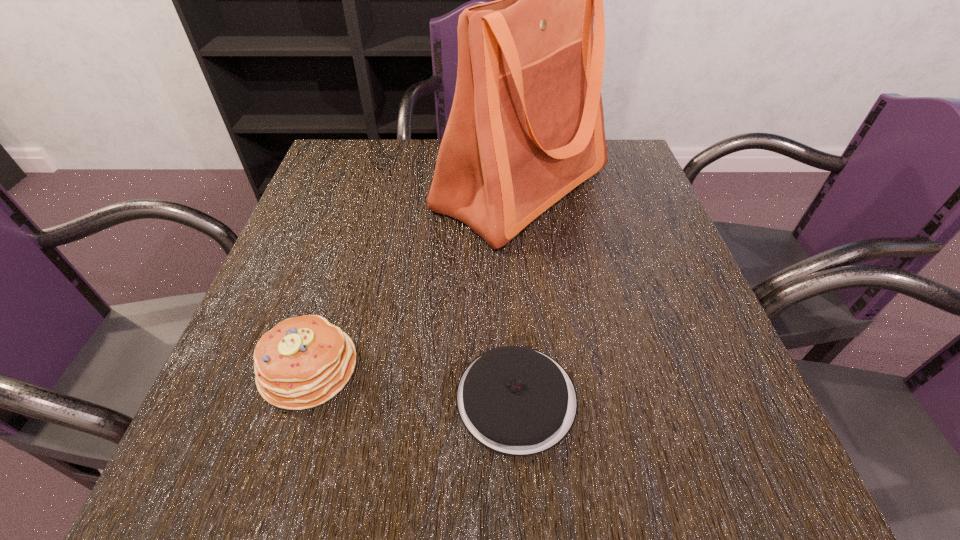
Identify the location of free area in between the farthest object and the shorter pancake. (519, 294).

The image size is (960, 540). What are the coordinates of `blank region between the right pancake and the shopping bag` in the screenshot? It's located at (519, 294).

Find the location of a particular element. The image size is (960, 540). unoccupied position between the farthest object and the shorter pancake is located at coordinates (519, 294).

Where is `vacant region between the shortest object and the shopping bag`? Image resolution: width=960 pixels, height=540 pixels. vacant region between the shortest object and the shopping bag is located at coordinates (519, 294).

At what (x,y) coordinates should I click in order to perform the action: click on free point between the shortest object and the left pancake. Please return your answer as a coordinate pair (x, y). The height and width of the screenshot is (540, 960). Looking at the image, I should click on (413, 383).

You are a GUI agent. You are given a task and a screenshot of the screen. Output one action in this format:
    pyautogui.click(x=<x>, y=<y>)
    Task: Click on the blank region between the second shortest object and the right pancake
    The height and width of the screenshot is (540, 960).
    Given the screenshot: What is the action you would take?
    pyautogui.click(x=413, y=383)

The width and height of the screenshot is (960, 540). In order to click on free space between the leftmost object and the tallest object in this screenshot , I will do `click(416, 278)`.

Where is `vacant area between the shorter pancake and the shopping bag`? vacant area between the shorter pancake and the shopping bag is located at coordinates (519, 294).

The image size is (960, 540). What are the coordinates of `vacant space that is in between the shorter pancake and the left pancake` in the screenshot? It's located at (413, 383).

This screenshot has width=960, height=540. I want to click on free space between the shortest object and the shopping bag, so click(x=519, y=294).